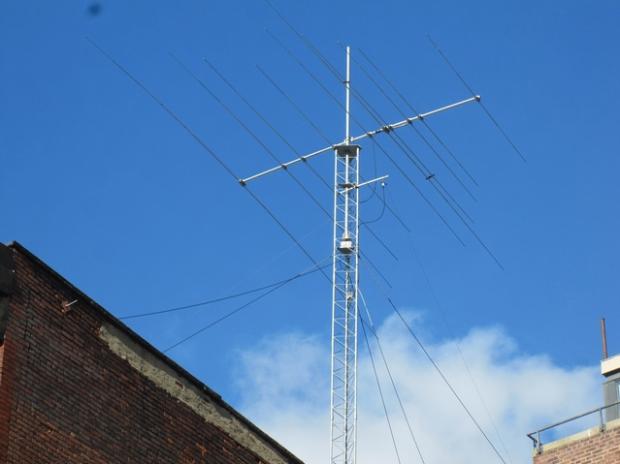
Locate an element on the screen. brick wall is located at coordinates (85, 402), (591, 447).